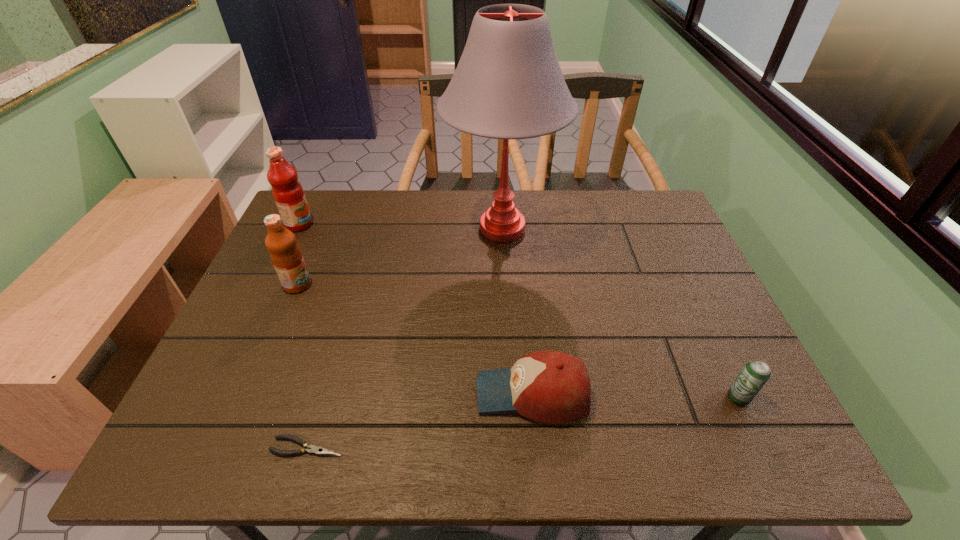
Find the location of a particular element. The image size is (960, 540). vacant space positioned on the front label of the nearer fruit juice is located at coordinates (440, 285).

Identify the location of vacant space located on the back of the beer can. (719, 357).

I want to click on free spot located on the front-facing side of the baseball cap, so click(348, 394).

Where is `free space located 0.270m on the front-facing side of the baseball cap`? The width and height of the screenshot is (960, 540). free space located 0.270m on the front-facing side of the baseball cap is located at coordinates (348, 394).

This screenshot has height=540, width=960. I want to click on vacant space situated on the front-facing side of the baseball cap, so click(x=348, y=394).

Where is `free space located on the right of the shortest object`? The image size is (960, 540). free space located on the right of the shortest object is located at coordinates (535, 447).

Identify the location of table lamp positioned at the far edge. The height and width of the screenshot is (540, 960). (508, 84).

Find the location of a particular element. fruit juice that is at the far edge is located at coordinates (287, 191).

The width and height of the screenshot is (960, 540). Find the location of `baseball cap present at the near edge`. baseball cap present at the near edge is located at coordinates [x=553, y=387].

You are a GUI agent. You are given a task and a screenshot of the screen. Output one action in this format:
    pyautogui.click(x=<x>, y=<y>)
    Task: Click on the pliers present at the near edge
    This screenshot has height=540, width=960.
    Given the screenshot: What is the action you would take?
    tap(311, 449)